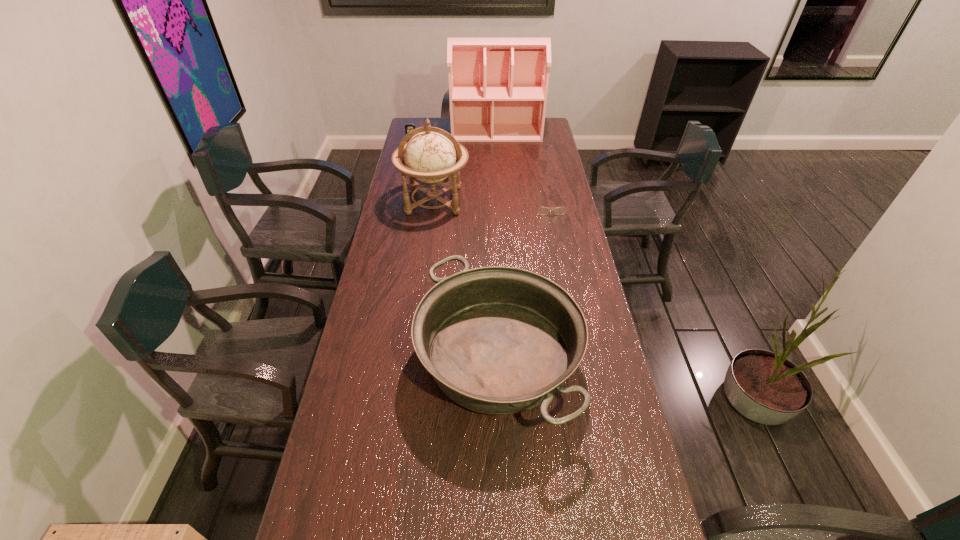
The image size is (960, 540). In order to click on object that is the second closest to the globe in this screenshot , I will do coord(408,127).

Where is `free space that satisfies the following two spatial constraints: 1. at the front of the globe showing Africa; 2. on the right side of the third tallest object`? free space that satisfies the following two spatial constraints: 1. at the front of the globe showing Africa; 2. on the right side of the third tallest object is located at coordinates (414, 357).

The height and width of the screenshot is (540, 960). I want to click on free spot that satisfies the following two spatial constraints: 1. on the screen of the pan; 2. on the left side of the cellular telephone, so click(364, 357).

The width and height of the screenshot is (960, 540). Find the location of `vacant area in the image that satisfies the following two spatial constraints: 1. on the screen of the pan; 2. on the right side of the fourth tallest object`. vacant area in the image that satisfies the following two spatial constraints: 1. on the screen of the pan; 2. on the right side of the fourth tallest object is located at coordinates (364, 357).